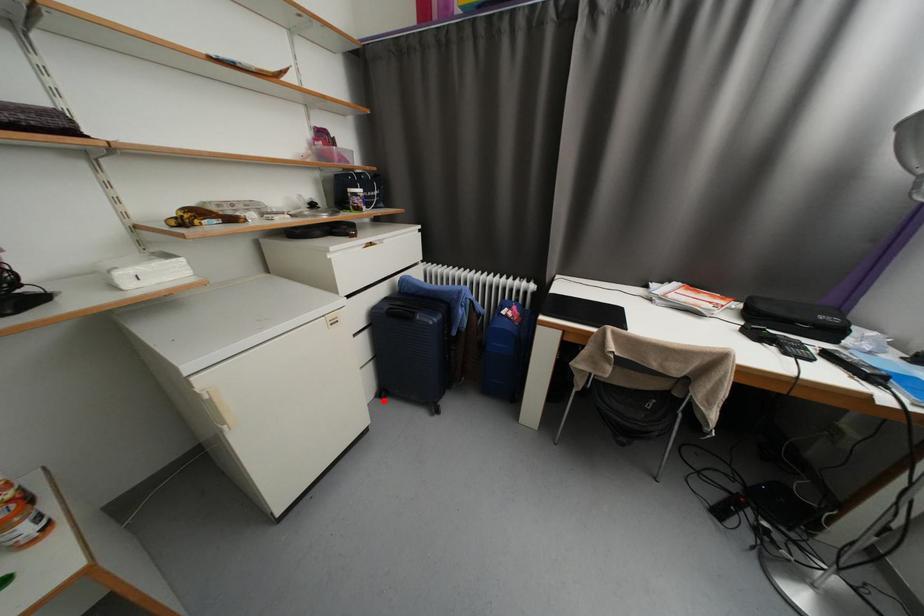
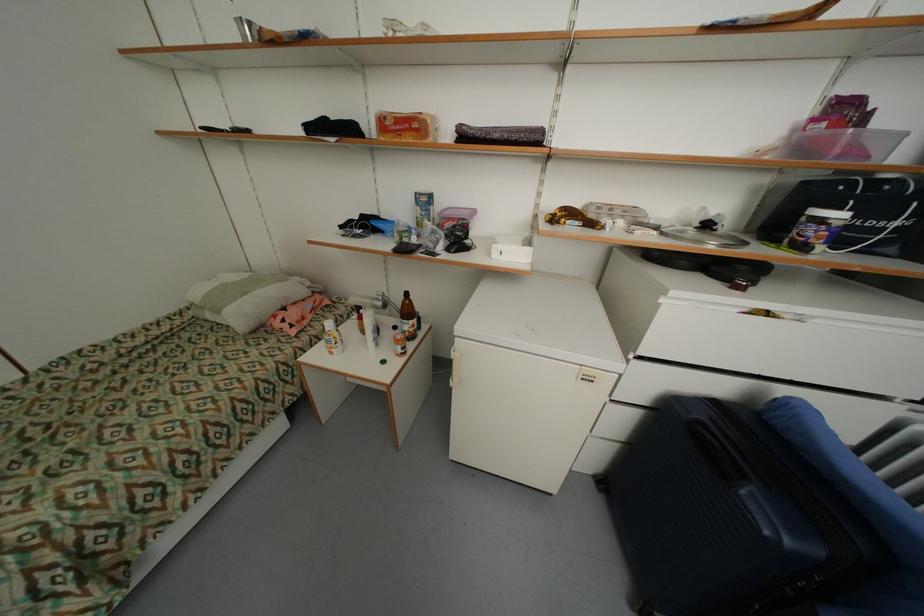
Locate, in the second image, the point that corresponds to the highlighted location in the first image.

(599, 483)